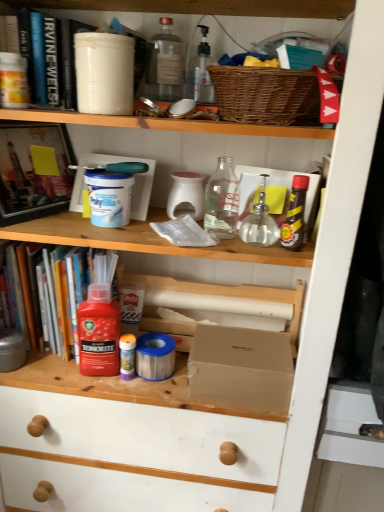
Question: Considering the relative positions of transparent glass bottle at upper center, positioned as the 5th bottle in bottom-to-top order, and hardcover book at upper left, the second book when ordered from top to bottom, in the image provided, is transparent glass bottle at upper center, positioned as the 5th bottle in bottom-to-top order, to the right of hardcover book at upper left, the second book when ordered from top to bottom, from the viewer's perspective?

Choices:
 (A) yes
 (B) no

Answer: (A)

Question: Does transparent glass bottle at upper center, the first bottle in the top-to-bottom sequence, come behind hardcover book at upper left, which is the second book from bottom to top?

Choices:
 (A) no
 (B) yes

Answer: (B)

Question: Could you tell me if transparent glass bottle at upper center, positioned as the 5th bottle in bottom-to-top order, is facing hardcover book at upper left, the second book when ordered from top to bottom?

Choices:
 (A) no
 (B) yes

Answer: (A)

Question: Is transparent glass bottle at upper center, which appears as the 3th bottle when viewed from the right, shorter than hardcover book at upper left, which is the second book from bottom to top?

Choices:
 (A) yes
 (B) no

Answer: (A)

Question: Can you confirm if transparent glass bottle at upper center, which appears as the 3th bottle when viewed from the right, is taller than hardcover book at upper left, which is the second book from bottom to top?

Choices:
 (A) no
 (B) yes

Answer: (A)

Question: Is transparent glass bottle at upper center, the first bottle in the top-to-bottom sequence, wider than hardcover book at upper left, the second book when ordered from top to bottom?

Choices:
 (A) no
 (B) yes

Answer: (A)

Question: From the image's perspective, is translucent plastic bottle at center, which appears as the 1th bottle when ordered from the bottom, located above shiny brown bottle at upper right, which is the first bottle from right to left?

Choices:
 (A) yes
 (B) no

Answer: (B)

Question: From a real-world perspective, does translucent plastic bottle at center, positioned as the fourth bottle in right-to-left order, sit lower than shiny brown bottle at upper right, the 3th bottle viewed from the top?

Choices:
 (A) no
 (B) yes

Answer: (B)

Question: Is translucent plastic bottle at center, which appears as the 1th bottle when ordered from the bottom, shorter than shiny brown bottle at upper right, the fifth bottle viewed from the left?

Choices:
 (A) yes
 (B) no

Answer: (A)

Question: Can you confirm if translucent plastic bottle at center, which is the fifth bottle from top to bottom, is taller than shiny brown bottle at upper right, marked as the third bottle in a bottom-to-top arrangement?

Choices:
 (A) no
 (B) yes

Answer: (A)

Question: Does translucent plastic bottle at center, acting as the second bottle starting from the left, have a smaller size compared to shiny brown bottle at upper right, marked as the third bottle in a bottom-to-top arrangement?

Choices:
 (A) yes
 (B) no

Answer: (A)

Question: Considering the relative positions of translucent plastic bottle at center, acting as the second bottle starting from the left, and shiny brown bottle at upper right, marked as the third bottle in a bottom-to-top arrangement, in the image provided, is translucent plastic bottle at center, acting as the second bottle starting from the left, to the right of shiny brown bottle at upper right, marked as the third bottle in a bottom-to-top arrangement, from the viewer's perspective?

Choices:
 (A) no
 (B) yes

Answer: (A)

Question: Are red plastic bottle at left, placed as the 1th book when sorted from bottom to top, and shiny brown bottle at upper right, the 3th bottle viewed from the top, beside each other?

Choices:
 (A) no
 (B) yes

Answer: (A)